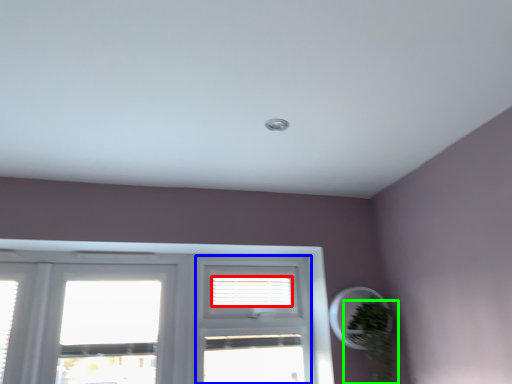
Question: Considering the real-world distances, which object is closest to blind (highlighted by a red box)? screen door (highlighted by a blue box) or houseplant (highlighted by a green box).

Choices:
 (A) screen door
 (B) houseplant

Answer: (A)